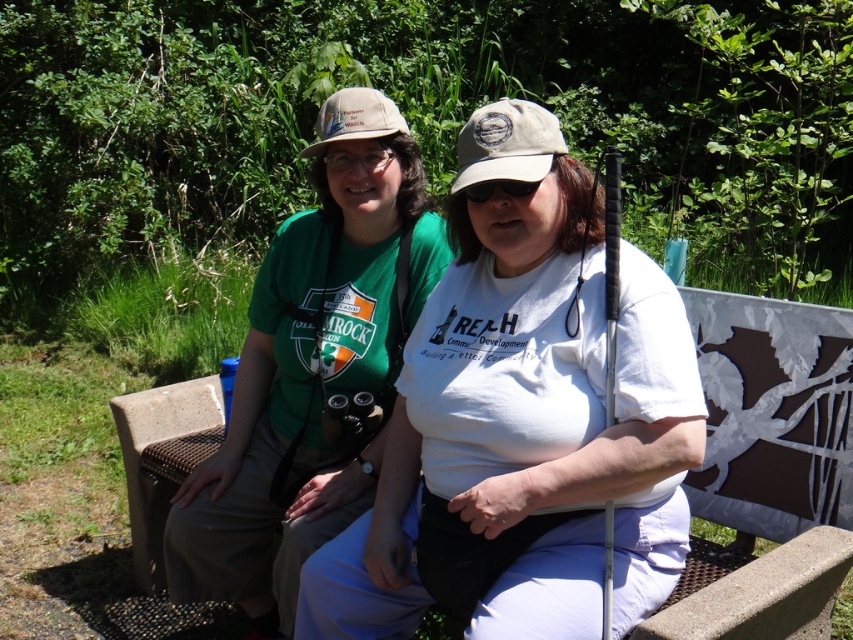
Which is behind, point (489, 404) or point (552, 129)?

The point (552, 129) is behind.

Is white matte shirt at center positioned in front of beige fabric baseball cap at center?

Yes, it is.

Does point (503, 300) come behind point (525, 102)?

That is True.

Locate an element on the screen. The height and width of the screenshot is (640, 853). white matte shirt at center is located at coordinates (525, 413).

Does white matte shirt at center come behind concrete bench at center?

No, white matte shirt at center is closer to the viewer.

Which is more to the right, white matte shirt at center or concrete bench at center?

concrete bench at center is more to the right.

Which is in front, point (584, 282) or point (821, 333)?

Positioned in front is point (584, 282).

Find the location of `white matte shirt at center`. white matte shirt at center is located at coordinates (525, 413).

Is beige fabric baseball cap at center positioned in front of khaki fabric baseball cap at center?

That is True.

Who is more forward, (474, 115) or (402, 125)?

Positioned in front is point (474, 115).

At what (x,y) coordinates should I click in order to perform the action: click on beige fabric baseball cap at center. Please return your answer as a coordinate pair (x, y). This screenshot has width=853, height=640. Looking at the image, I should click on (508, 144).